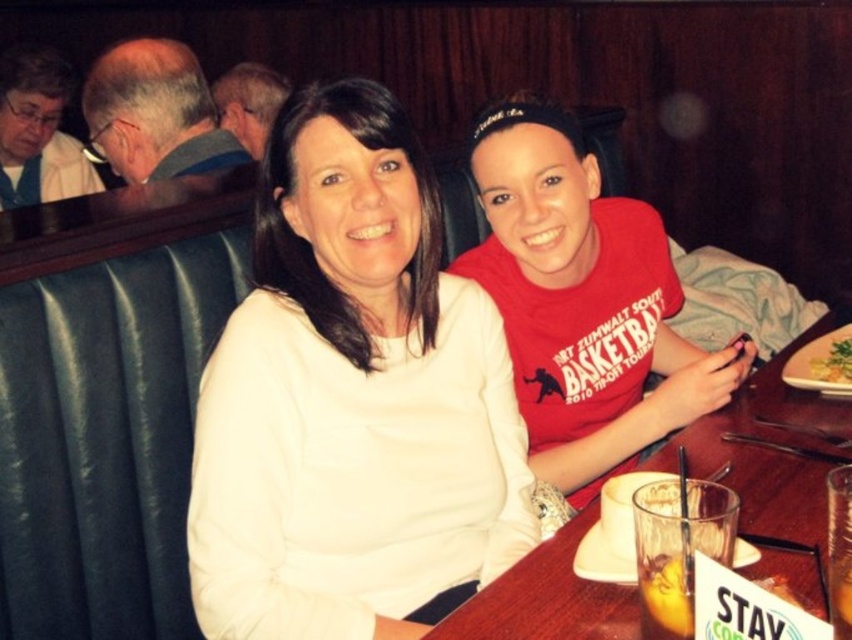
Measure the distance between white matte sweater at center and wooden table at center.

They are 13.68 inches apart.

Who is positioned more to the right, white matte sweater at center or wooden table at center?

From the viewer's perspective, wooden table at center appears more on the right side.

Is point (435, 500) more distant than point (780, 520)?

Yes, it is behind point (780, 520).

You are a GUI agent. You are given a task and a screenshot of the screen. Output one action in this format:
    pyautogui.click(x=<x>, y=<y>)
    Task: Click on the white matte sweater at center
    The width and height of the screenshot is (852, 640).
    Given the screenshot: What is the action you would take?
    pyautogui.click(x=352, y=401)

Does red matte shirt at center lie in front of yellowish matte plate at lower right?

That is True.

Measure the distance from red matte shirt at center to yellowish matte plate at lower right.

The distance of red matte shirt at center from yellowish matte plate at lower right is 15.81 inches.

What do you see at coordinates (582, 301) in the screenshot? The image size is (852, 640). I see `red matte shirt at center` at bounding box center [582, 301].

The width and height of the screenshot is (852, 640). In order to click on red matte shirt at center in this screenshot , I will do `click(582, 301)`.

Is white ceramic plate at upper right positioned at the back of translucent glass at table right?

That is True.

How much distance is there between white ceramic plate at upper right and translucent glass at table right?

27.64 inches

Identify the location of white ceramic plate at upper right. Image resolution: width=852 pixels, height=640 pixels. (821, 364).

You are a GUI agent. You are given a task and a screenshot of the screen. Output one action in this format:
    pyautogui.click(x=<x>, y=<y>)
    Task: Click on the white ceramic plate at upper right
    The width and height of the screenshot is (852, 640).
    Given the screenshot: What is the action you would take?
    pyautogui.click(x=821, y=364)